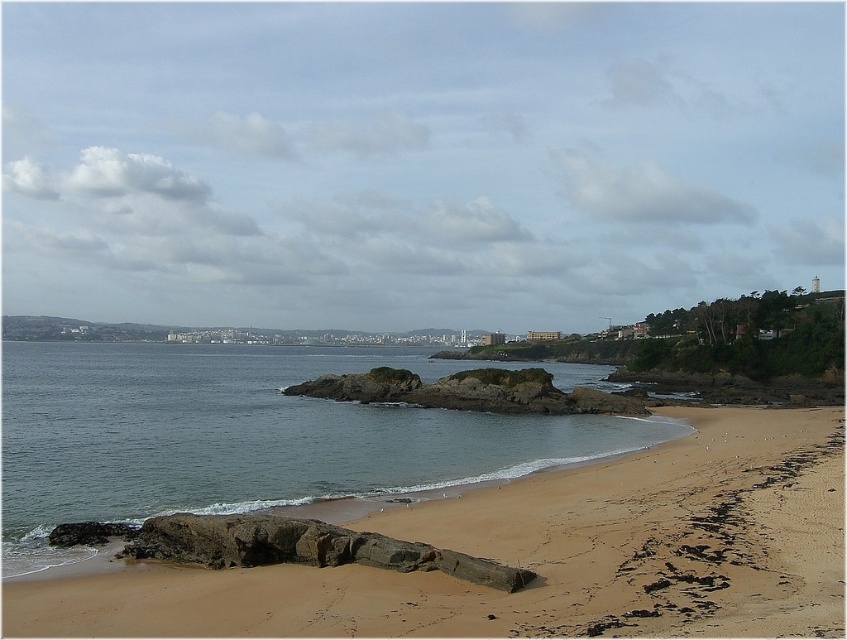
Is brown sandy beach at lower center taller than brown rocky island at center?

Incorrect, brown sandy beach at lower center's height is not larger of brown rocky island at center's.

Does brown sandy beach at lower center appear on the left side of brown rocky island at center?

Incorrect, brown sandy beach at lower center is not on the left side of brown rocky island at center.

Is point (731, 589) positioned after point (353, 384)?

No, it is in front of (353, 384).

Identify the location of brown sandy beach at lower center. (540, 554).

Which is more to the left, brown sandy beach at lower center or clear water at beach center?

clear water at beach center is more to the left.

Between point (834, 468) and point (87, 385), which one is positioned behind?

The point (87, 385) is behind.

Image resolution: width=847 pixels, height=640 pixels. I want to click on brown sandy beach at lower center, so click(540, 554).

Does clear water at beach center appear over brown rocky island at center?

No.

Does clear water at beach center have a larger size compared to brown rocky island at center?

Correct, clear water at beach center is larger in size than brown rocky island at center.

This screenshot has width=847, height=640. I want to click on clear water at beach center, so pyautogui.click(x=250, y=435).